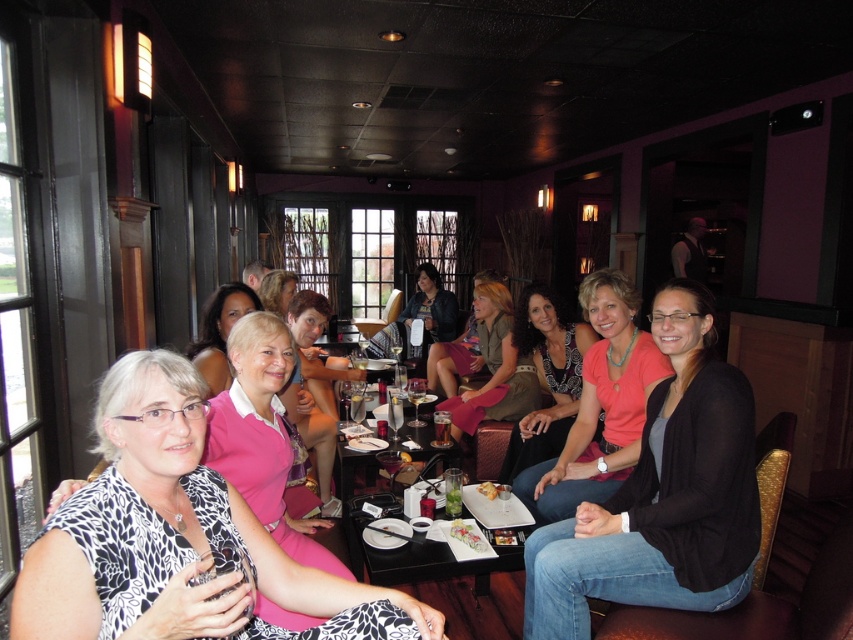
You are a waiter at the restaurant and need to place a new drink order on the table. The martini must be placed behind the existing drinks. Where should you place the clear glass martini at center relative to the black glass table at center?

The black glass table at center is in front of the clear glass martini at center, so to place the martini behind the existing drinks, you should position it behind the black glass table at center.

You are a waiter at the restaurant and need to place a new drink order for the group. The drink is 10 cm tall. Can you safely place it on the black glass table at center without it touching the pink matte shirt at center?

The black glass table at center is taller than the pink matte shirt at center. Since the drink is only 10 cm tall, placing it on the table ensures it won not touch the shirt, as the table is higher than the shirt.

Consider the image. You are a photographer at the restaurant and want to capture a photo of the printed fabric dress at center and the matte black top at center. Which one is positioned lower on the image?

The printed fabric dress at center is located below the matte black top at center, so it is positioned lower in the image.